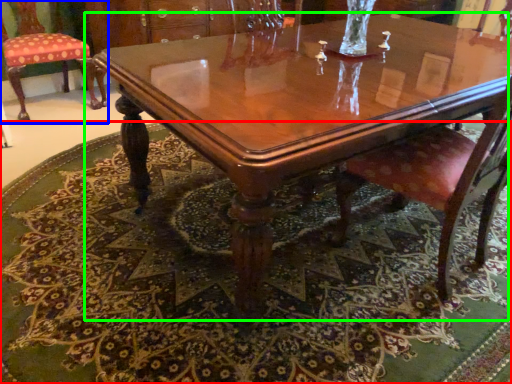
Question: Which is nearer to the mat (highlighted by a red box)? chair (highlighted by a blue box) or coffee table (highlighted by a green box).

Choices:
 (A) chair
 (B) coffee table

Answer: (B)